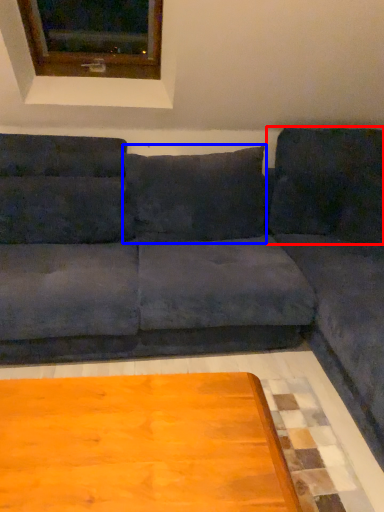
Question: Which object is further to the camera taking this photo, pillow (highlighted by a red box) or pillow (highlighted by a blue box)?

Choices:
 (A) pillow
 (B) pillow

Answer: (A)